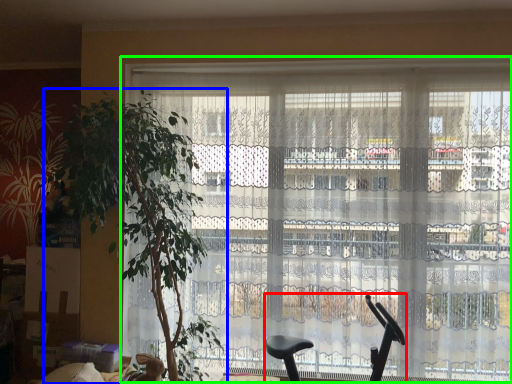
Question: Based on their relative distances, which object is nearer to baby carriage (highlighted by a red box)? Choose from houseplant (highlighted by a blue box) and window (highlighted by a green box).

Choices:
 (A) houseplant
 (B) window

Answer: (B)